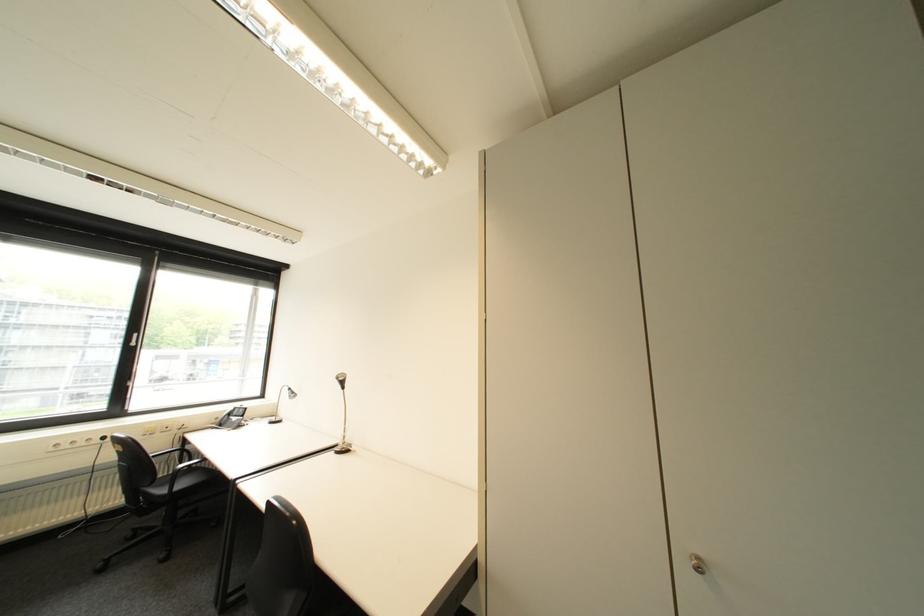
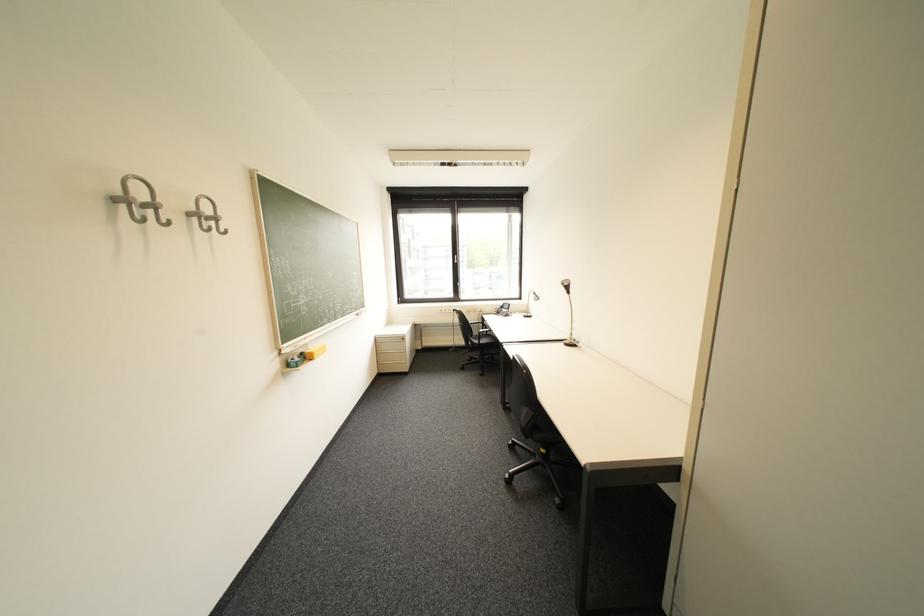
Locate, in the second image, the point that corresponds to (342,455) in the first image.

(572, 345)